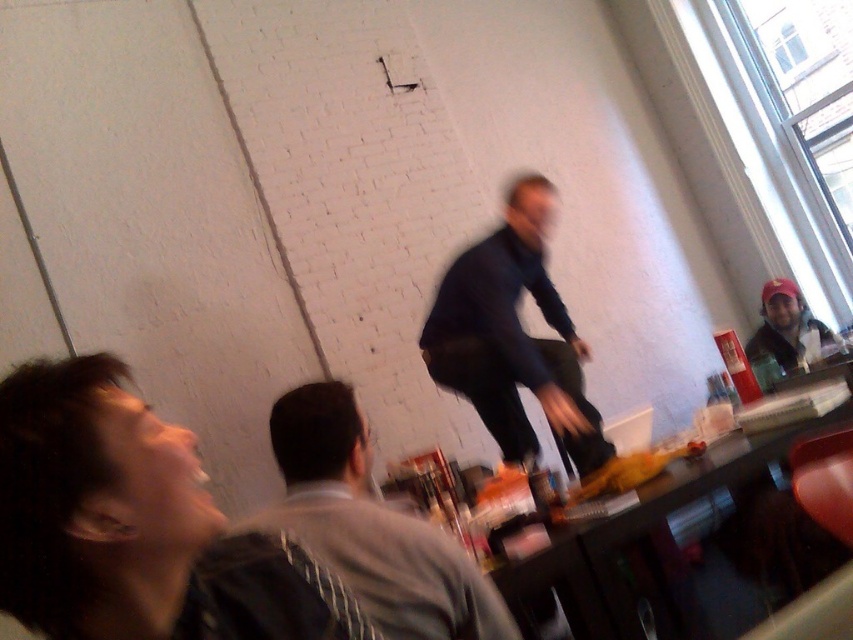
You are standing at the entrance of the room and want to greet the person wearing the gray fabric shirt at center. Based on their position coordinates, in which general direction should you walk to approach them?

The gray fabric shirt at center is located at coordinates point (370, 525), which places them in the central area of the room. Since you are at the entrance, you should walk straight ahead to reach them.

Consider the image. You are a delivery person trying to place a small package between the dark blue fabric pants at center and the matte black cap at upper right. Can the package, which is 3 feet long, fit in the space between them?

The space between the dark blue fabric pants at center and the matte black cap at upper right is 4.10 feet, so yes, the 3 feet long package can fit in the space between them.

You are organizing a photo shoot in this room and need to place a small prop between the gray fabric shirt at center and the matte black cap at upper right. Which object should the prop be closer to if it needs to be near the smaller one?

The gray fabric shirt at center is smaller than the matte black cap at upper right, so the prop should be placed closer to the gray fabric shirt at center.